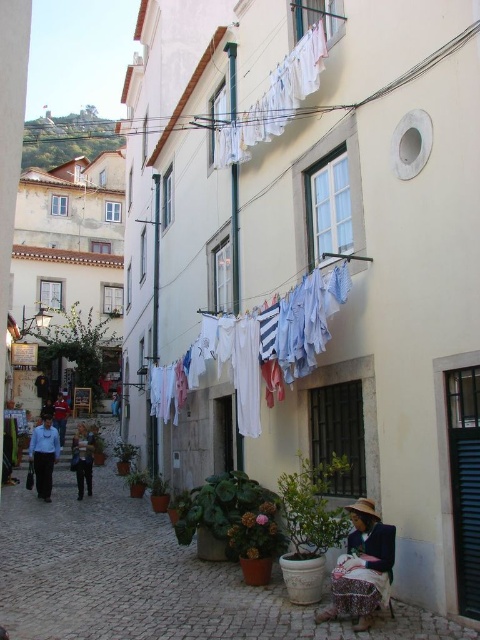
Is white fabric clothesline at upper center closer to the viewer compared to red fabric jacket at left?

That is True.

Is point (251, 128) more distant than point (64, 417)?

No, (251, 128) is in front of (64, 417).

Locate an element on the screen. Image resolution: width=480 pixels, height=640 pixels. white fabric clothesline at upper center is located at coordinates (275, 100).

Does plaid fabric skirt at lower right have a larger size compared to dark blue jeans at lower left?

Incorrect, plaid fabric skirt at lower right is not larger than dark blue jeans at lower left.

Between point (360, 502) and point (80, 449), which one is positioned behind?

Point (80, 449)

Find the location of a particular element. The width and height of the screenshot is (480, 640). plaid fabric skirt at lower right is located at coordinates (x=361, y=568).

Does dark blue jeans at lower left have a greater height compared to red fabric jacket at left?

No, dark blue jeans at lower left is not taller than red fabric jacket at left.

Which is behind, point (87, 488) or point (67, 413)?

Positioned behind is point (67, 413).

Identify the location of dark blue jeans at lower left. The height and width of the screenshot is (640, 480). (83, 460).